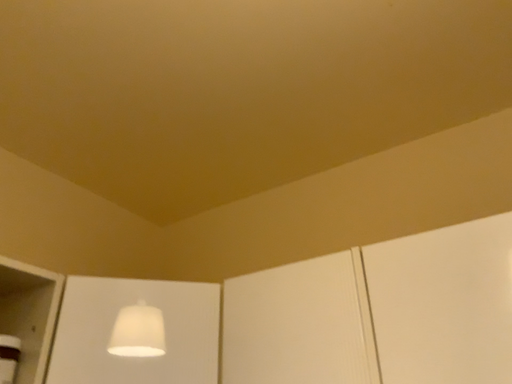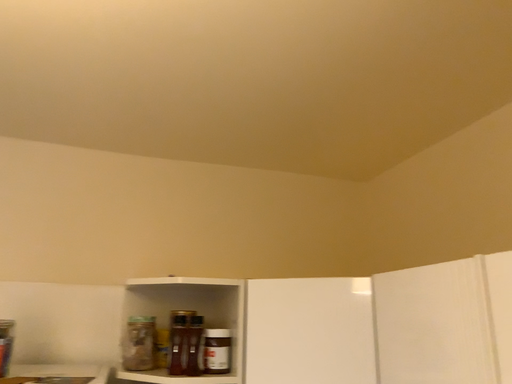
Question: How did the camera likely rotate when shooting the video?

Choices:
 (A) rotated downward
 (B) rotated upward

Answer: (A)